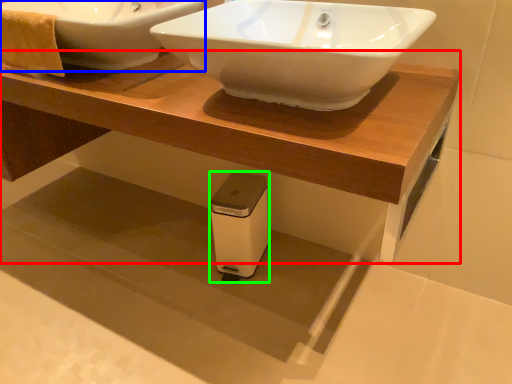
Question: Which object is the closest to the table (highlighted by a red box)? Choose among these: sink (highlighted by a blue box) or appliance (highlighted by a green box).

Choices:
 (A) sink
 (B) appliance

Answer: (A)